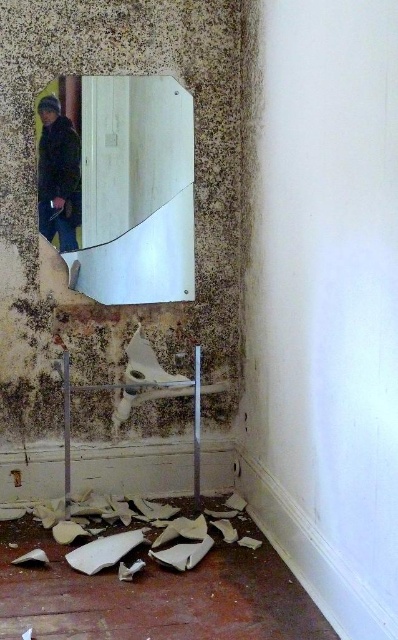
Question: Is white matte debris at lower center below dark blue jacket at left?

Choices:
 (A) no
 (B) yes

Answer: (B)

Question: Which point is closer to the camera?

Choices:
 (A) dark blue jacket at left
 (B) white matte debris at lower center

Answer: (B)

Question: Is white matte debris at lower center below dark blue jacket at left?

Choices:
 (A) no
 (B) yes

Answer: (B)

Question: Which of the following is the closest to the observer?

Choices:
 (A) dark blue jacket at left
 (B) white matte debris at lower center

Answer: (B)

Question: Can you confirm if white matte debris at lower center is wider than dark blue jacket at left?

Choices:
 (A) no
 (B) yes

Answer: (B)